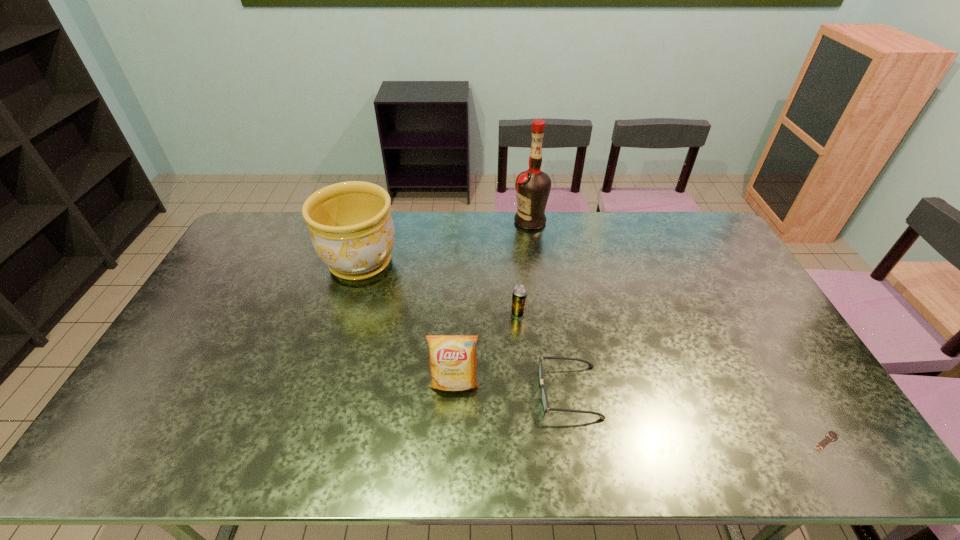
The width and height of the screenshot is (960, 540). I want to click on the tallest object, so click(x=533, y=186).

Find the location of `the farthest object`. the farthest object is located at coordinates (533, 186).

Find the location of a particular element. The width and height of the screenshot is (960, 540). the leftmost object is located at coordinates (352, 231).

Locate an element on the screen. The height and width of the screenshot is (540, 960). the fifth shortest object is located at coordinates (352, 231).

Where is `crisp (potato chip)`? This screenshot has width=960, height=540. crisp (potato chip) is located at coordinates (453, 365).

You are a GUI agent. You are given a task and a screenshot of the screen. Output one action in this format:
    pyautogui.click(x=<x>, y=<y>)
    Task: Click on the fifth object from right to left
    
    Given the screenshot: What is the action you would take?
    pyautogui.click(x=453, y=365)

You are a GUI agent. You are given a task and a screenshot of the screen. Output one action in this format:
    pyautogui.click(x=<x>, y=<y>)
    Task: Click on the third shortest object
    
    Given the screenshot: What is the action you would take?
    pyautogui.click(x=519, y=296)

Locate an element on the screen. This screenshot has width=960, height=540. the fourth nearest object is located at coordinates tap(519, 296).

I want to click on the fifth tallest object, so click(544, 398).

You are a GUI agent. You are given a task and a screenshot of the screen. Output one action in this format:
    pyautogui.click(x=<x>, y=<y>)
    Task: Click on the nearest object
    Image resolution: width=960 pixels, height=540 pixels.
    Given the screenshot: What is the action you would take?
    pyautogui.click(x=831, y=435)